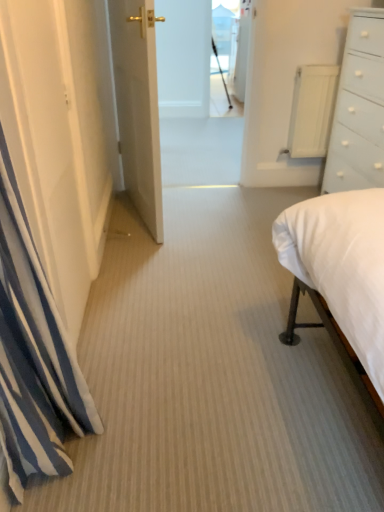
Find the location of a particular element. The image size is (384, 512). vacant space underneath white striped curtain at left (from a real-world perspective) is located at coordinates (74, 466).